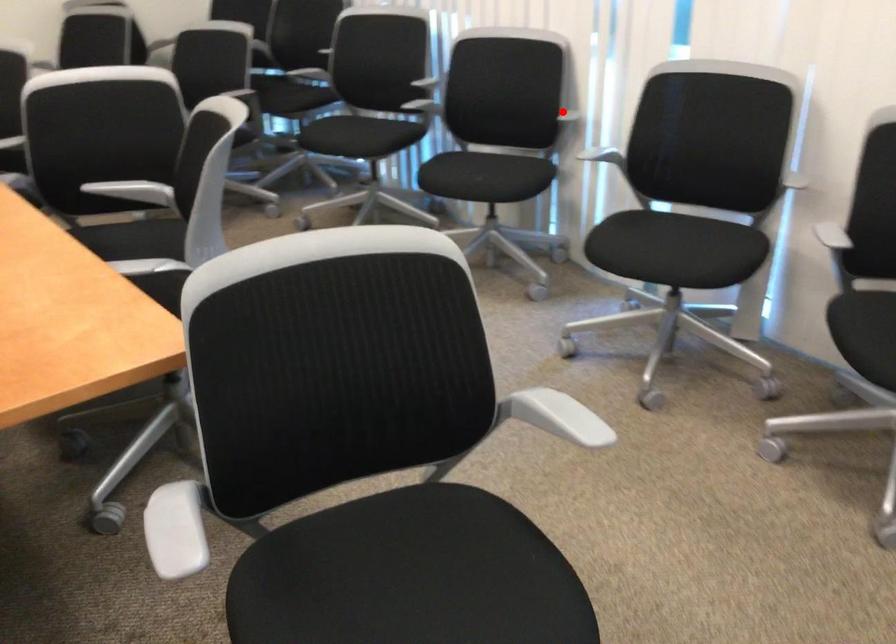
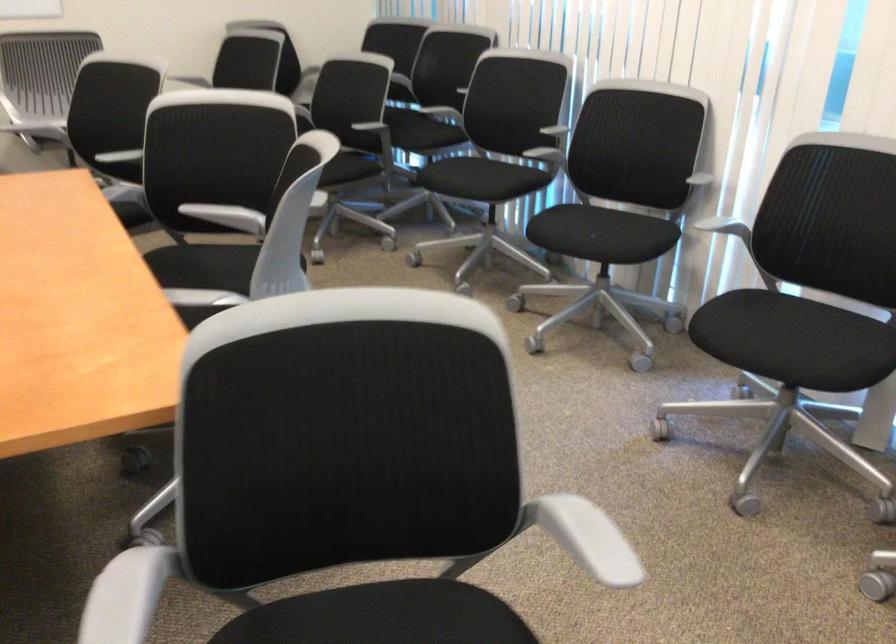
Find the pixel in the second image that matches the highlighted location in the first image.

(693, 174)